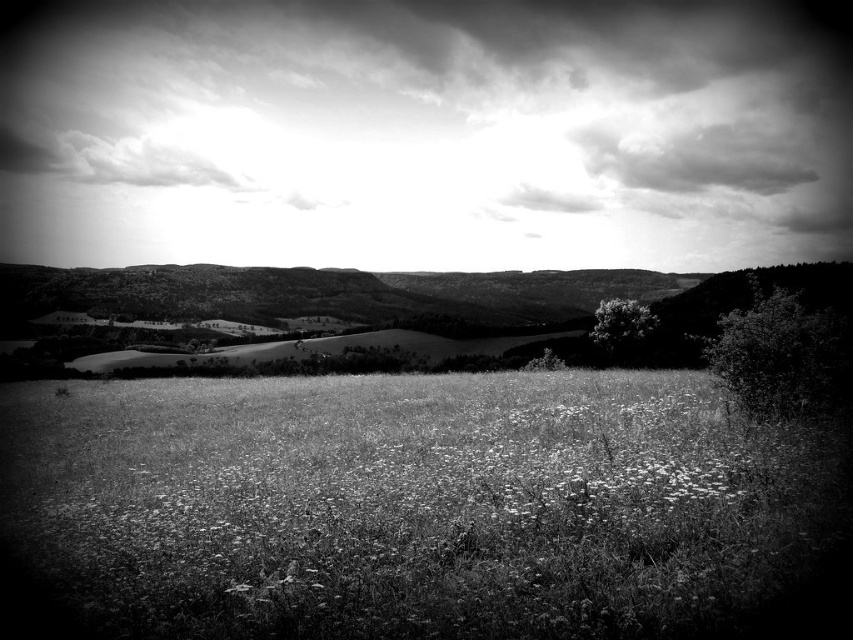
Question: Considering the relative positions of cloudy sky at upper center and dark green leafy tree at right in the image provided, where is cloudy sky at upper center located with respect to dark green leafy tree at right?

Choices:
 (A) left
 (B) right

Answer: (A)

Question: Is white soft grass at center bigger than green leafy tree at center?

Choices:
 (A) yes
 (B) no

Answer: (A)

Question: Considering the relative positions of white textured tree at center and green leafy tree at center in the image provided, where is white textured tree at center located with respect to green leafy tree at center?

Choices:
 (A) left
 (B) right

Answer: (B)

Question: Which object is farther from the camera taking this photo?

Choices:
 (A) white soft grass at center
 (B) green leafy tree at center
 (C) white textured tree at center

Answer: (C)

Question: Among these objects, which one is nearest to the camera?

Choices:
 (A) white soft grass at center
 (B) cloudy sky at upper center

Answer: (A)

Question: Which object is farther from the camera taking this photo?

Choices:
 (A) white soft grass at center
 (B) cloudy sky at upper center
 (C) dark green leafy tree at right

Answer: (B)